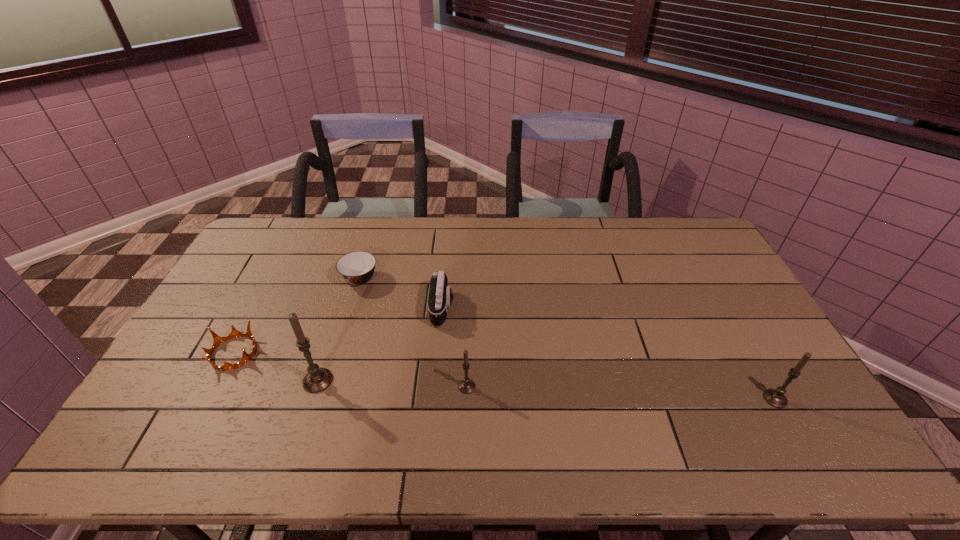
The width and height of the screenshot is (960, 540). Identify the location of free space that satisfies the following two spatial constraints: 1. on the front lens of the second tallest object; 2. on the left side of the fourth tallest object. (435, 399).

Locate an element on the screen. This screenshot has height=540, width=960. free spot that satisfies the following two spatial constraints: 1. on the back side of the soup bowl; 2. on the left side of the leftmost candle is located at coordinates (350, 279).

You are a GUI agent. You are given a task and a screenshot of the screen. Output one action in this format:
    pyautogui.click(x=<x>, y=<y>)
    Task: Click on the blank space that satisfies the following two spatial constraints: 1. on the front lens of the camera; 2. on the back side of the rightmost candle
    This screenshot has width=960, height=540.
    Given the screenshot: What is the action you would take?
    pyautogui.click(x=435, y=399)